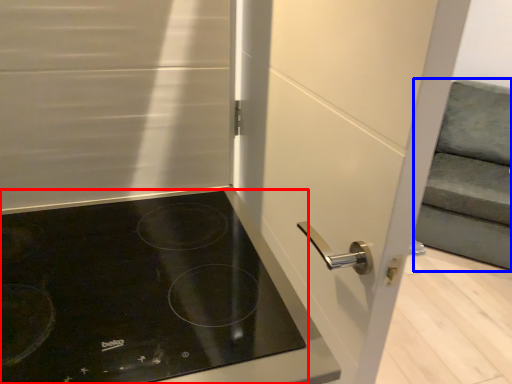
Question: Which object appears farthest to the camera in this image, gas stove (highlighted by a red box) or armchair (highlighted by a blue box)?

Choices:
 (A) gas stove
 (B) armchair

Answer: (B)